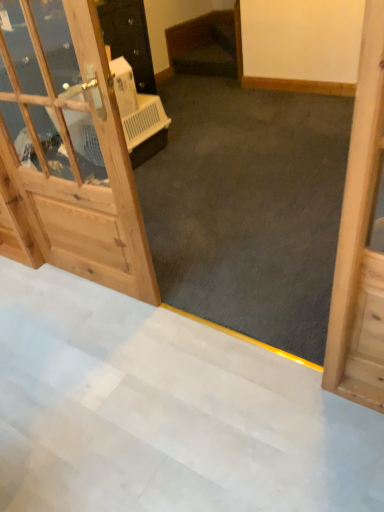
The width and height of the screenshot is (384, 512). Describe the element at coordinates (360, 239) in the screenshot. I see `wooden door at right` at that location.

The height and width of the screenshot is (512, 384). I want to click on wooden door at right, so click(360, 239).

At what (x,y) coordinates should I click in order to perform the action: click on wooden door at right. Please return your answer as a coordinate pair (x, y). This screenshot has width=384, height=512. Looking at the image, I should click on (360, 239).